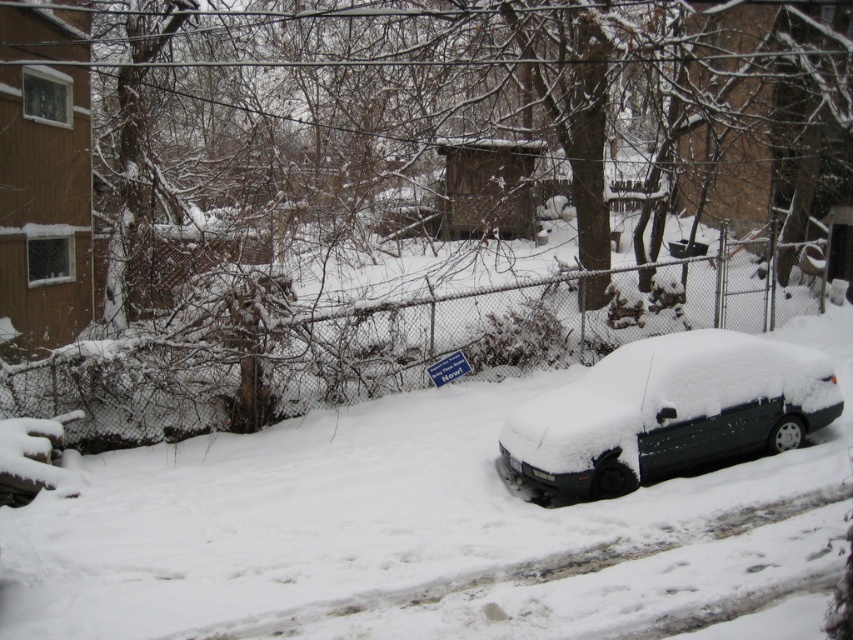
Question: Among these points, which one is nearest to the camera?

Choices:
 (A) (512, 464)
 (B) (218, 401)

Answer: (A)

Question: Considering the relative positions of chain-link fence at center and snow-covered sedan at right in the image provided, where is chain-link fence at center located with respect to snow-covered sedan at right?

Choices:
 (A) left
 (B) right

Answer: (A)

Question: Is the position of chain-link fence at center more distant than that of snow-covered sedan at right?

Choices:
 (A) no
 (B) yes

Answer: (B)

Question: Among these objects, which one is farthest from the camera?

Choices:
 (A) chain-link fence at center
 (B) snow-covered sedan at right

Answer: (A)

Question: From the image, what is the correct spatial relationship of chain-link fence at center in relation to snow-covered sedan at right?

Choices:
 (A) left
 (B) right

Answer: (A)